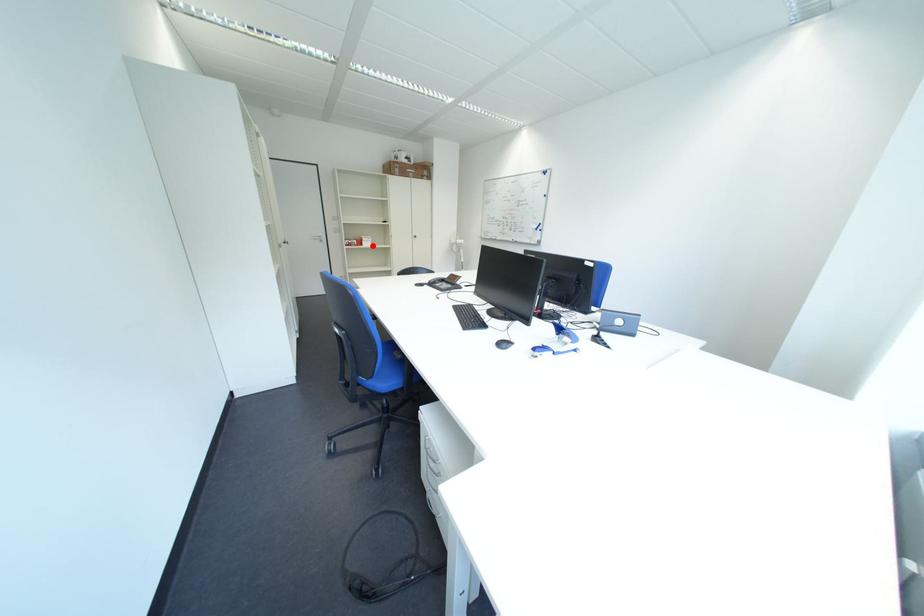
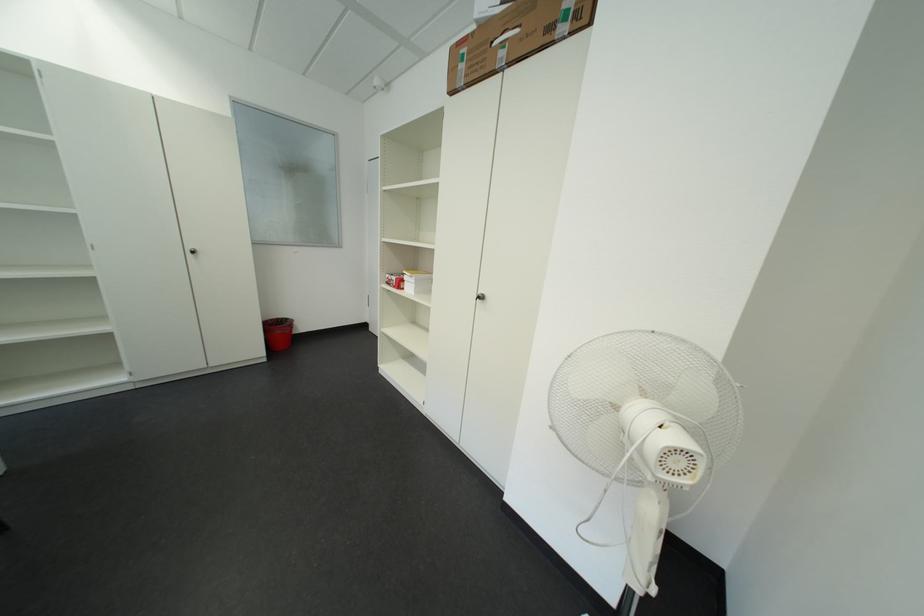
The point at the highlighted location is marked in the first image. Where is the corresponding point in the second image?

(411, 286)